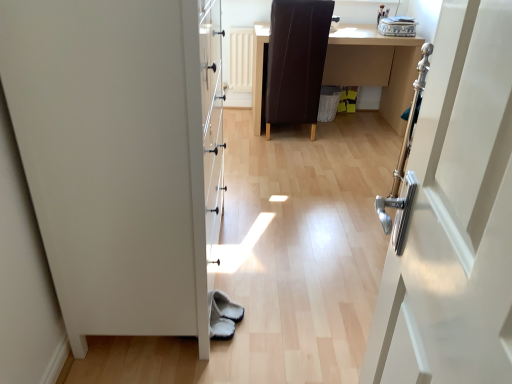
Question: Is point (305, 99) closer or farther from the camera than point (373, 72)?

Choices:
 (A) farther
 (B) closer

Answer: (B)

Question: Considering the positions of brown leather chair at center and brown leather desk at center in the image, is brown leather chair at center bigger or smaller than brown leather desk at center?

Choices:
 (A) big
 (B) small

Answer: (B)

Question: Considering the real-world distances, which object is closest to the white matte door at left?

Choices:
 (A) brown leather chair at center
 (B) brown leather desk at center

Answer: (A)

Question: Which object is positioned closest to the brown leather chair at center?

Choices:
 (A) brown leather desk at center
 (B) white matte door at left

Answer: (A)